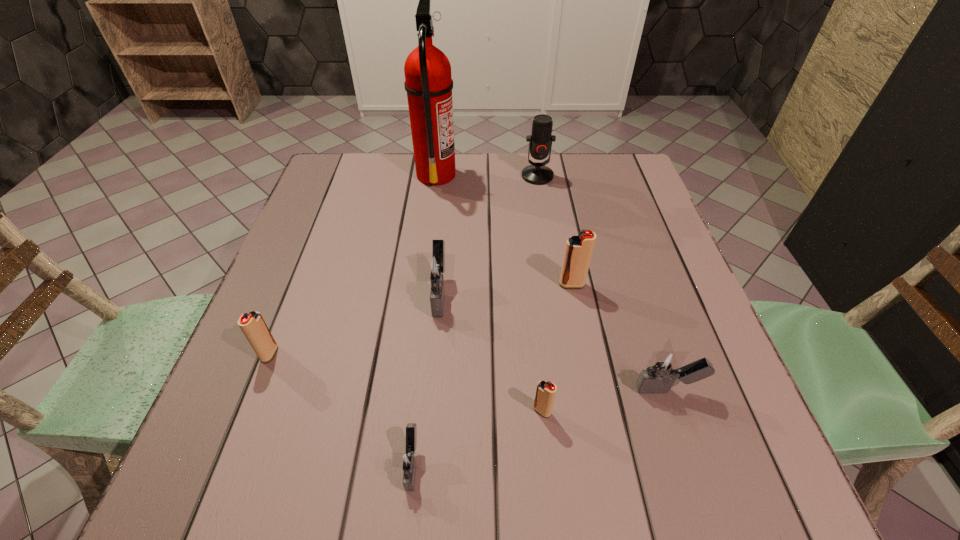
I want to click on blank space that satisfies the following two spatial constraints: 1. on the front side of the second smallest red igniter; 2. on the left side of the nearest gray igniter, so click(x=226, y=464).

Where is `free space that satisfies the following two spatial constraints: 1. on the side of the microphone with the red ring; 2. on the right side of the rightmost object`? The height and width of the screenshot is (540, 960). free space that satisfies the following two spatial constraints: 1. on the side of the microphone with the red ring; 2. on the right side of the rightmost object is located at coordinates (572, 389).

Locate an element on the screen. The image size is (960, 540). vacant space that satisfies the following two spatial constraints: 1. on the side of the fire extinguisher near the handle; 2. on the left side of the nearest igniter is located at coordinates (400, 464).

Where is `free region that satisfies the following two spatial constraints: 1. on the side of the tallest object near the handle; 2. on the back side of the rightmost red igniter`? free region that satisfies the following two spatial constraints: 1. on the side of the tallest object near the handle; 2. on the back side of the rightmost red igniter is located at coordinates (422, 285).

Locate an element on the screen. This screenshot has width=960, height=540. blank area in the image that satisfies the following two spatial constraints: 1. on the side of the microphone with the red ring; 2. on the right side of the second smallest gray igniter is located at coordinates (572, 389).